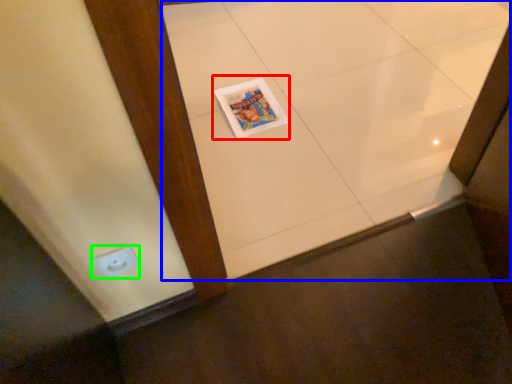
Question: Based on their relative distances, which object is nearer to magazine (highlighted by a red box)? Choose from ceramic tile (highlighted by a blue box) and electric outlet (highlighted by a green box).

Choices:
 (A) ceramic tile
 (B) electric outlet

Answer: (A)